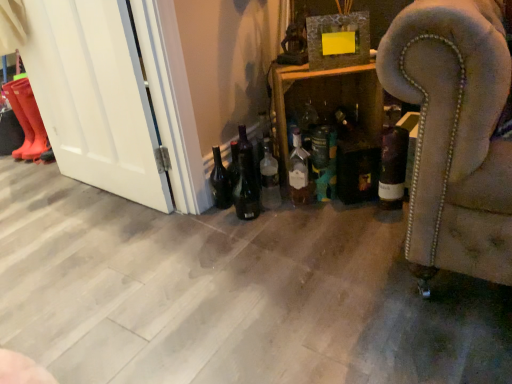
At what (x,y) coordinates should I click in order to perform the action: click on free space in front of dark glass bottle at center-right, which ranks as the fifth bottle in left-to-right order. Please return your answer as a coordinate pair (x, y). This screenshot has width=512, height=384. Looking at the image, I should click on (389, 225).